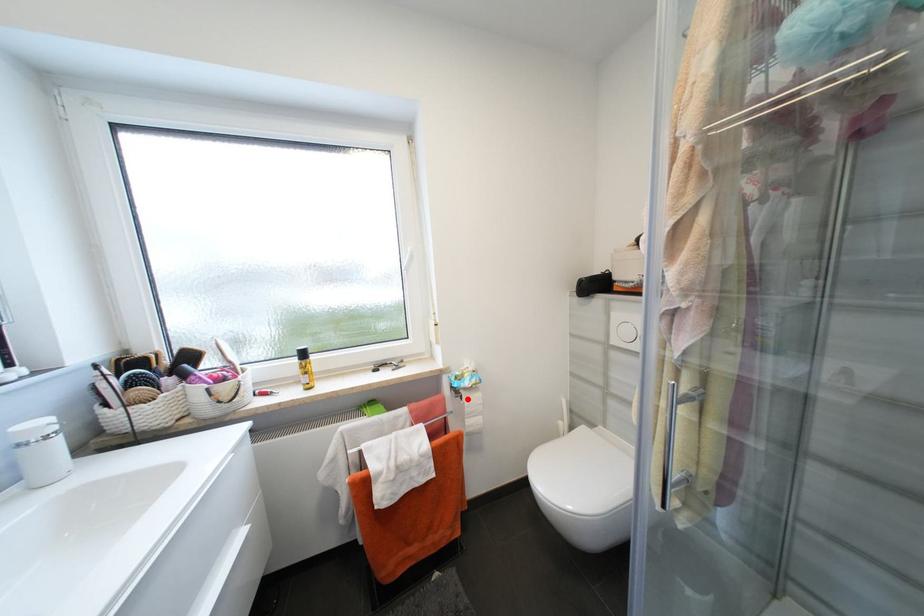
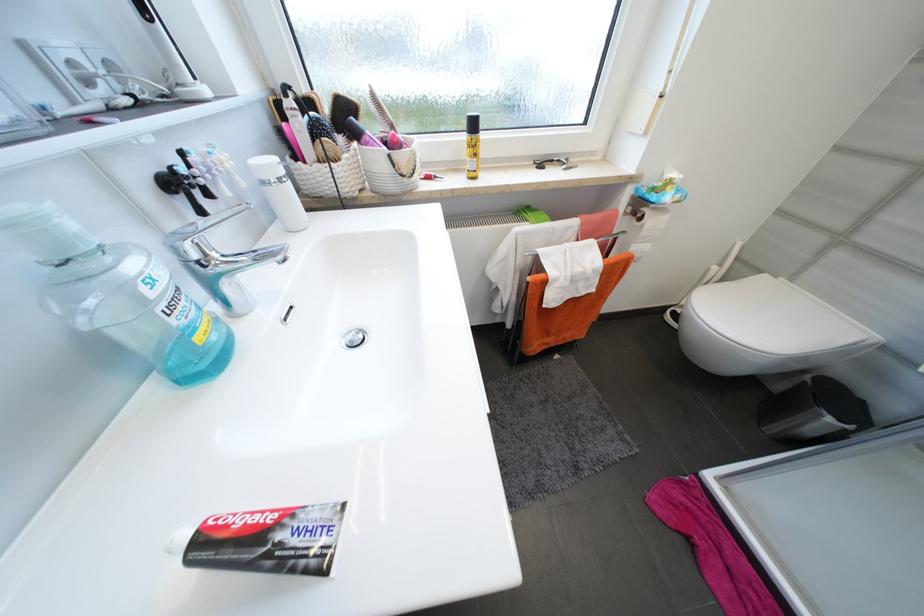
Question: I am providing you with two images of the same scene from different viewpoints. In image1, a red point is highlighted. Considering the same 3D point in image2, which of the following is correct?

Choices:
 (A) It is closer
 (B) It is farther

Answer: (A)